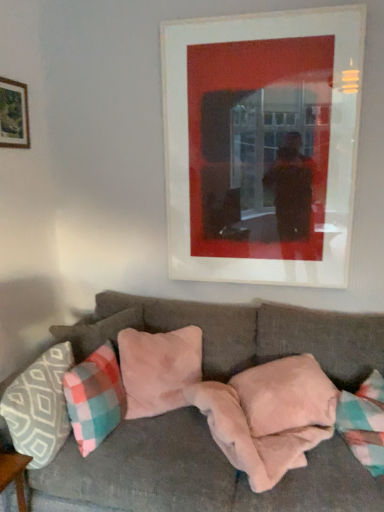
Question: Can you confirm if matte white picture frame at upper center, acting as the 1th picture frame starting from the right, is wider than pink suede pillow at center, positioned as the 2th pillow in left-to-right order?

Choices:
 (A) yes
 (B) no

Answer: (B)

Question: Can you confirm if matte white picture frame at upper center, arranged as the second picture frame when viewed from the left, is shorter than pink suede pillow at center, positioned as the 2th pillow in left-to-right order?

Choices:
 (A) no
 (B) yes

Answer: (A)

Question: Can you confirm if matte white picture frame at upper center, acting as the 1th picture frame starting from the right, is thinner than pink suede pillow at center, marked as the fourth pillow in a right-to-left arrangement?

Choices:
 (A) no
 (B) yes

Answer: (B)

Question: Is matte white picture frame at upper center, acting as the 1th picture frame starting from the right, at the right side of pink suede pillow at center, positioned as the 2th pillow in left-to-right order?

Choices:
 (A) no
 (B) yes

Answer: (B)

Question: Considering the relative sizes of matte white picture frame at upper center, arranged as the second picture frame when viewed from the left, and pink suede pillow at center, positioned as the 2th pillow in left-to-right order, in the image provided, is matte white picture frame at upper center, arranged as the second picture frame when viewed from the left, smaller than pink suede pillow at center, positioned as the 2th pillow in left-to-right order,?

Choices:
 (A) no
 (B) yes

Answer: (A)

Question: Considering the positions of point (319, 32) and point (100, 297), is point (319, 32) closer or farther from the camera than point (100, 297)?

Choices:
 (A) closer
 (B) farther

Answer: (A)

Question: From a real-world perspective, is matte white picture frame at upper center, arranged as the second picture frame when viewed from the left, physically located above or below velvet gray couch at center?

Choices:
 (A) above
 (B) below

Answer: (A)

Question: In terms of height, does matte white picture frame at upper center, arranged as the second picture frame when viewed from the left, look taller or shorter compared to velvet gray couch at center?

Choices:
 (A) short
 (B) tall

Answer: (B)

Question: Considering the positions of matte white picture frame at upper center, arranged as the second picture frame when viewed from the left, and velvet gray couch at center in the image, is matte white picture frame at upper center, arranged as the second picture frame when viewed from the left, wider or thinner than velvet gray couch at center?

Choices:
 (A) wide
 (B) thin

Answer: (B)

Question: Is point (281, 369) positioned closer to the camera than point (160, 391)?

Choices:
 (A) farther
 (B) closer

Answer: (B)

Question: Is pink plush pillow at center, the fifth pillow when ordered from left to right, inside the boundaries of suede-like beige pillow at center, marked as the 4th pillow in a left-to-right arrangement, or outside?

Choices:
 (A) outside
 (B) inside

Answer: (A)

Question: From the image's perspective, is pink plush pillow at center, the fifth pillow when ordered from left to right, located above or below suede-like beige pillow at center, the second pillow from the right?

Choices:
 (A) above
 (B) below

Answer: (B)

Question: From a real-world perspective, relative to suede-like beige pillow at center, marked as the 4th pillow in a left-to-right arrangement, is pink plush pillow at center, the fifth pillow when ordered from left to right, vertically above or below?

Choices:
 (A) above
 (B) below

Answer: (B)

Question: Based on their sizes in the image, would you say plaid fabric pillow at lower left, the third pillow from the right, is bigger or smaller than wooden frame at upper left, positioned as the 1th picture frame in left-to-right order?

Choices:
 (A) small
 (B) big

Answer: (B)

Question: Relative to wooden frame at upper left, which ranks as the 2th picture frame in right-to-left order, is plaid fabric pillow at lower left, the third pillow from the right, in front or behind?

Choices:
 (A) front
 (B) behind

Answer: (A)